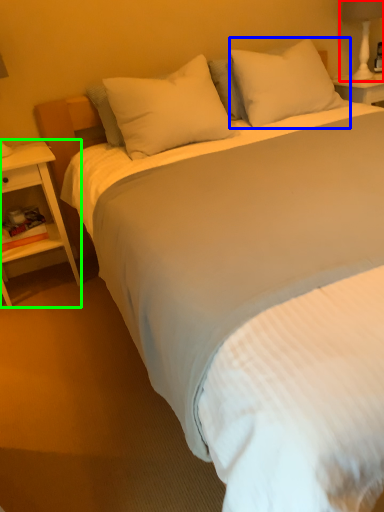
Question: Which object is positioned farthest from bedside lamp (highlighted by a red box)? Select from pillow (highlighted by a blue box) and nightstand (highlighted by a green box).

Choices:
 (A) pillow
 (B) nightstand

Answer: (B)